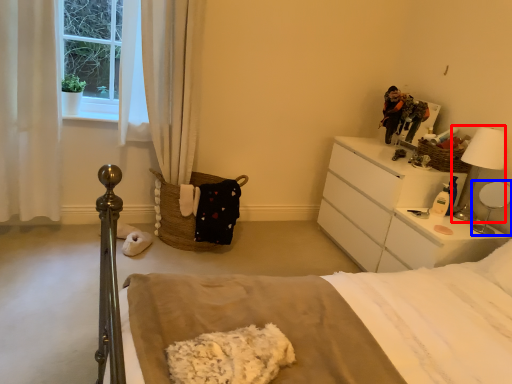
Question: Which object is further to the camera taking this photo, table lamp (highlighted by a red box) or table lamp (highlighted by a blue box)?

Choices:
 (A) table lamp
 (B) table lamp

Answer: (A)